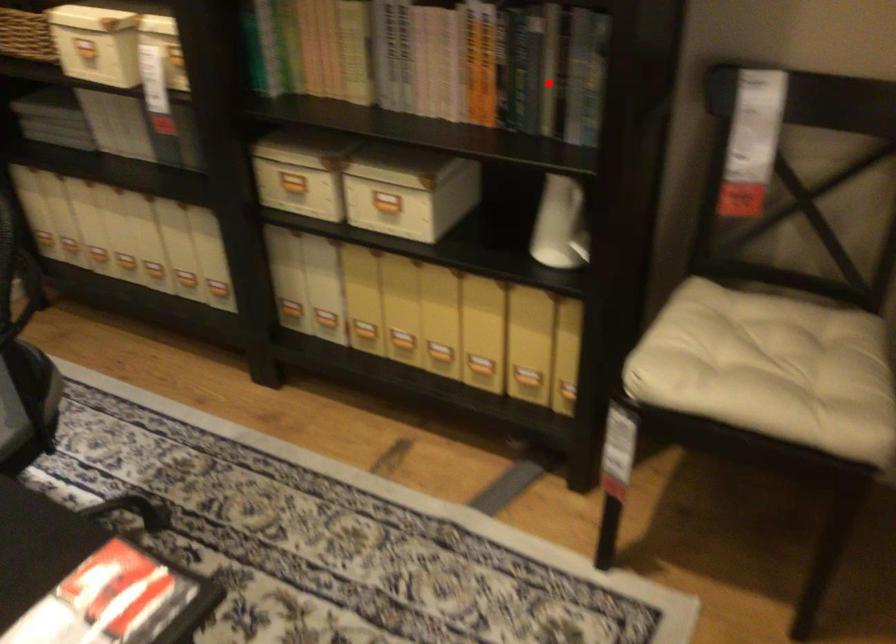
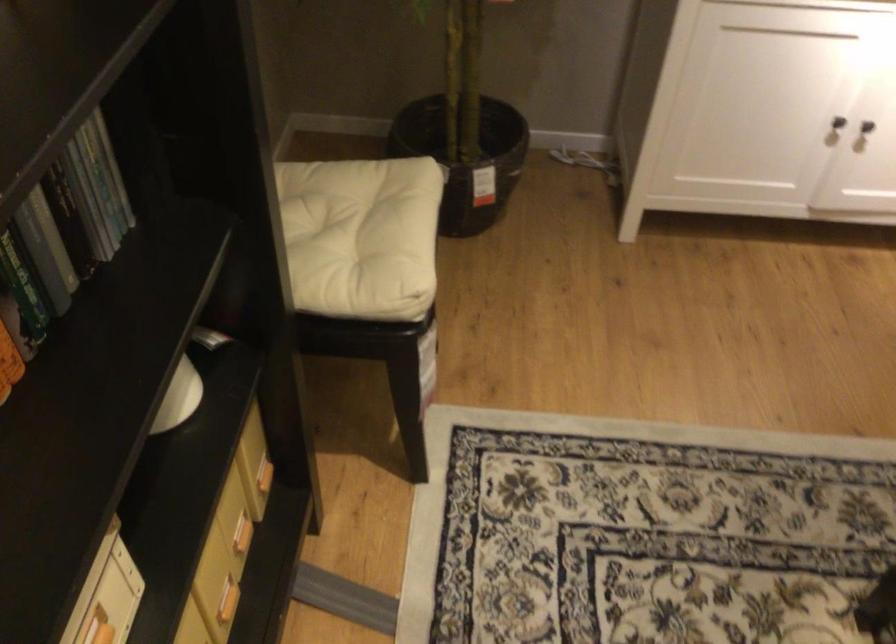
Question: I am providing you with two images of the same scene from different viewpoints. A red point is marked on the first image. At the location where the point appears in image 1, is it still visible in image 2?

Choices:
 (A) Yes
 (B) No

Answer: (A)